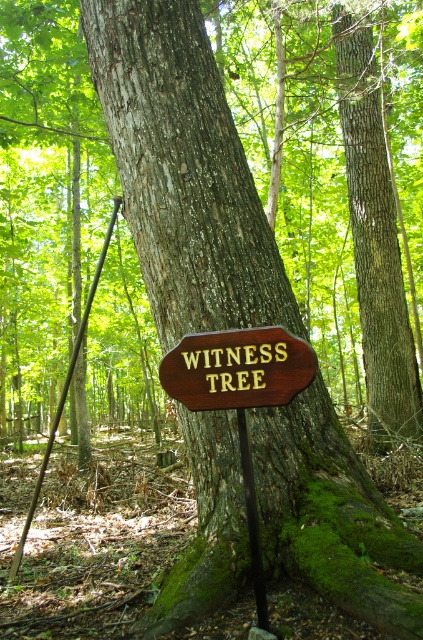
Question: Considering the real-world distances, which object is farthest from the brown rough bark tree trunk at center?

Choices:
 (A) wooden sign at center
 (B) brushed metal pole at left

Answer: (A)

Question: Can you confirm if wooden sign at center is positioned below black metal pole at center?

Choices:
 (A) no
 (B) yes

Answer: (A)

Question: Based on their relative distances, which object is nearer to the brushed metal pole at left?

Choices:
 (A) brown rough bark tree trunk at center
 (B) black metal pole at center

Answer: (B)

Question: Among these points, which one is nearest to the camera?

Choices:
 (A) (269, 372)
 (B) (367, 116)
 (C) (65, 396)
 (D) (239, 445)

Answer: (A)

Question: Does brushed metal pole at left have a larger size compared to black metal pole at center?

Choices:
 (A) yes
 (B) no

Answer: (A)

Question: Is brown rough bark tree trunk at center below wooden sign at center?

Choices:
 (A) no
 (B) yes

Answer: (A)